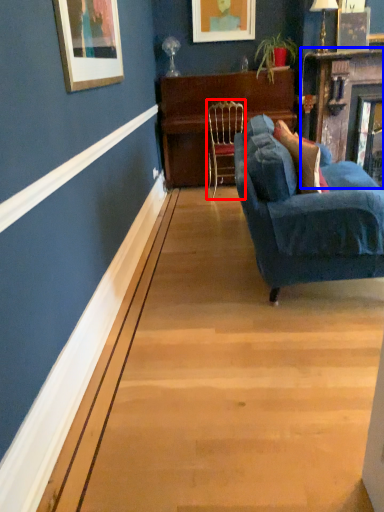
Question: Which object appears closest to the camera in this image, chair (highlighted by a red box) or fireplace (highlighted by a blue box)?

Choices:
 (A) chair
 (B) fireplace

Answer: (B)